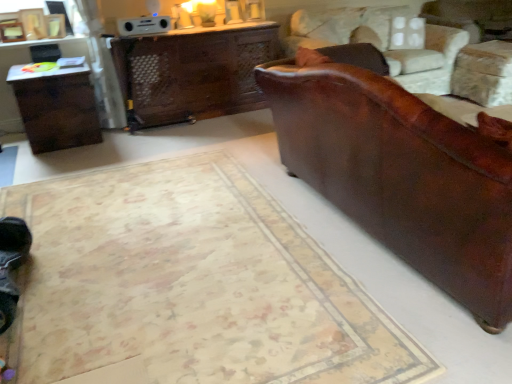
Find the location of `vacant point above dark brown wood table at left (from a real-world perspective)`. vacant point above dark brown wood table at left (from a real-world perspective) is located at coordinates (46, 69).